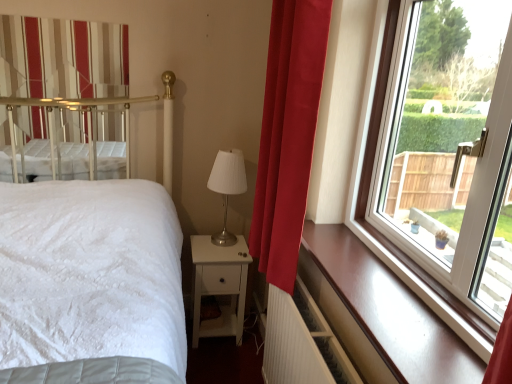
Question: From a real-world perspective, is white ribbed radiator at lower right positioned over glossy wood window sill at right based on gravity?

Choices:
 (A) no
 (B) yes

Answer: (A)

Question: Is there a large distance between white ribbed radiator at lower right and glossy wood window sill at right?

Choices:
 (A) no
 (B) yes

Answer: (A)

Question: Does white ribbed radiator at lower right have a smaller size compared to glossy wood window sill at right?

Choices:
 (A) no
 (B) yes

Answer: (A)

Question: Can you confirm if white ribbed radiator at lower right is wider than glossy wood window sill at right?

Choices:
 (A) yes
 (B) no

Answer: (B)

Question: Could you tell me if white ribbed radiator at lower right is facing glossy wood window sill at right?

Choices:
 (A) no
 (B) yes

Answer: (A)

Question: Is point (212, 241) closer or farther from the camera than point (474, 360)?

Choices:
 (A) closer
 (B) farther

Answer: (B)

Question: From the image's perspective, is metallic silver table lamp at center located above or below glossy wood window sill at right?

Choices:
 (A) above
 (B) below

Answer: (A)

Question: From a real-world perspective, is metallic silver table lamp at center positioned above or below glossy wood window sill at right?

Choices:
 (A) below
 (B) above

Answer: (A)

Question: Based on their positions, is metallic silver table lamp at center located to the left or right of glossy wood window sill at right?

Choices:
 (A) right
 (B) left

Answer: (B)

Question: From their relative heights in the image, would you say velvet red curtain at right, which is the 2th curtain from back to front, is taller or shorter than transparent glass window at right?

Choices:
 (A) short
 (B) tall

Answer: (B)

Question: From a real-world perspective, is velvet red curtain at right, which is the 2th curtain from back to front, above or below transparent glass window at right?

Choices:
 (A) below
 (B) above

Answer: (A)

Question: Considering their positions, is velvet red curtain at right, which is the 2th curtain from back to front, located in front of or behind transparent glass window at right?

Choices:
 (A) behind
 (B) front

Answer: (A)

Question: Choose the correct answer: Is velvet red curtain at right, which is the 2th curtain from left to right, inside transparent glass window at right or outside it?

Choices:
 (A) outside
 (B) inside

Answer: (A)

Question: Would you say velvet red curtain at right, which appears as the first curtain when viewed from the right, is to the left or to the right of white ribbed radiator at lower right in the picture?

Choices:
 (A) left
 (B) right

Answer: (A)

Question: Do you think velvet red curtain at right, which is the 2th curtain from back to front, is within white ribbed radiator at lower right, or outside of it?

Choices:
 (A) outside
 (B) inside

Answer: (A)